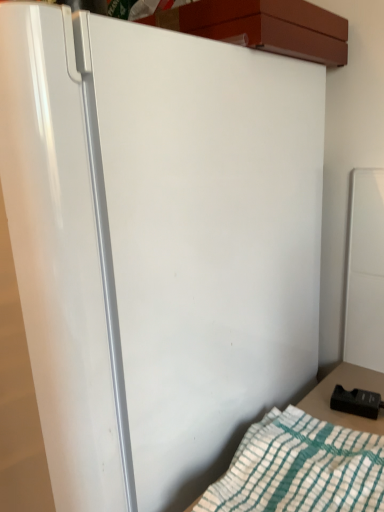
Question: Does point (359, 428) appear closer or farther from the camera than point (238, 471)?

Choices:
 (A) closer
 (B) farther

Answer: (B)

Question: Considering the positions of black plastic remote control at lower right and white cotton blanket at lower right in the image, is black plastic remote control at lower right bigger or smaller than white cotton blanket at lower right?

Choices:
 (A) big
 (B) small

Answer: (B)

Question: From the image's perspective, is black plastic remote control at lower right located above or below white cotton blanket at lower right?

Choices:
 (A) above
 (B) below

Answer: (A)

Question: Is white cotton blanket at lower right bigger or smaller than black plastic remote control at lower right?

Choices:
 (A) small
 (B) big

Answer: (B)

Question: Considering their positions, is white cotton blanket at lower right located in front of or behind black plastic remote control at lower right?

Choices:
 (A) behind
 (B) front

Answer: (B)

Question: Would you say white cotton blanket at lower right is inside or outside black plastic remote control at lower right?

Choices:
 (A) outside
 (B) inside

Answer: (A)

Question: From their relative heights in the image, would you say white cotton blanket at lower right is taller or shorter than black plastic remote control at lower right?

Choices:
 (A) tall
 (B) short

Answer: (B)